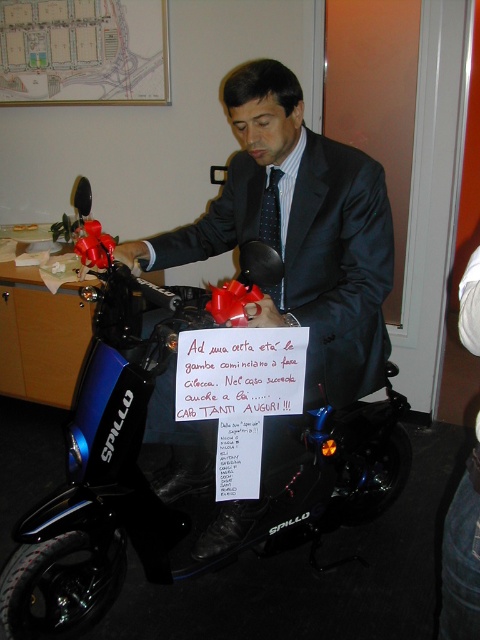
Question: Which point is closer to the camera?

Choices:
 (A) shiny black suit at center
 (B) black dotted tie at center
 (C) white paper sign at center
 (D) blue glossy scooter at center

Answer: (C)

Question: Is shiny black suit at center above black dotted tie at center?

Choices:
 (A) no
 (B) yes

Answer: (A)

Question: Among these points, which one is nearest to the camera?

Choices:
 (A) (267, 164)
 (B) (55, 618)
 (C) (267, 182)
 (D) (289, 349)

Answer: (D)

Question: Among these objects, which one is nearest to the camera?

Choices:
 (A) black dotted tie at center
 (B) white paper sign at center
 (C) shiny black suit at center
 (D) blue glossy scooter at center

Answer: (B)

Question: In this image, where is blue glossy scooter at center located relative to white paper sign at center?

Choices:
 (A) below
 (B) above

Answer: (A)

Question: Does blue glossy scooter at center have a smaller size compared to shiny black suit at center?

Choices:
 (A) no
 (B) yes

Answer: (A)